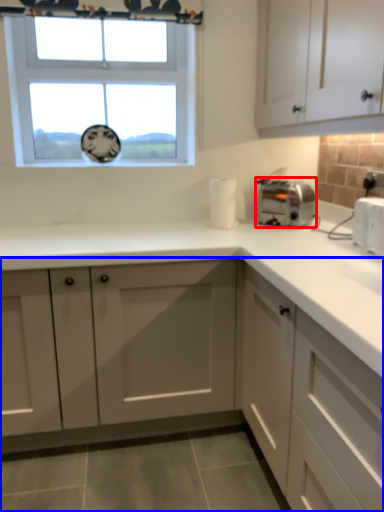
Question: Among these objects, which one is nearest to the camera, toaster (highlighted by a red box) or cabinetry (highlighted by a blue box)?

Choices:
 (A) toaster
 (B) cabinetry

Answer: (B)